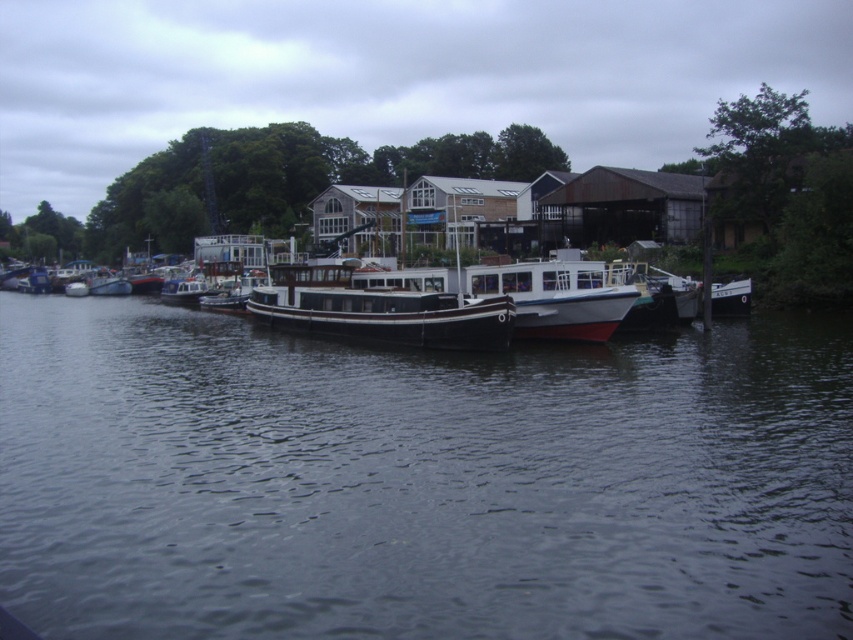
Question: Among these points, which one is nearest to the camera?

Choices:
 (A) (553, 449)
 (B) (556, 324)

Answer: (A)

Question: Is dark water at center smaller than black matte houseboat at center?

Choices:
 (A) yes
 (B) no

Answer: (B)

Question: Which of these objects is positioned farthest from the dark water at center?

Choices:
 (A) white matte boat at center
 (B) black matte houseboat at center

Answer: (B)

Question: Does dark water at center have a greater width compared to black matte houseboat at center?

Choices:
 (A) yes
 (B) no

Answer: (A)

Question: Is dark water at center smaller than black matte houseboat at center?

Choices:
 (A) no
 (B) yes

Answer: (A)

Question: Which of the following is the farthest from the observer?

Choices:
 (A) white matte boat at center
 (B) dark water at center

Answer: (A)